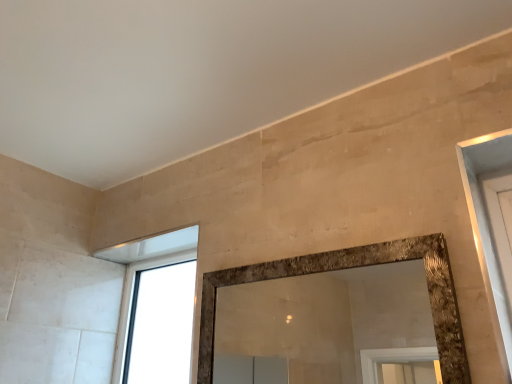
Question: Is the position of transparent glass window at upper left more distant than that of beige stone wall at upper center?

Choices:
 (A) no
 (B) yes

Answer: (B)

Question: Is transparent glass window at upper left not close to beige stone wall at upper center?

Choices:
 (A) yes
 (B) no

Answer: (B)

Question: Is transparent glass window at upper left located outside beige stone wall at upper center?

Choices:
 (A) yes
 (B) no

Answer: (A)

Question: Can you confirm if transparent glass window at upper left is smaller than beige stone wall at upper center?

Choices:
 (A) yes
 (B) no

Answer: (A)

Question: Is transparent glass window at upper left thinner than beige stone wall at upper center?

Choices:
 (A) no
 (B) yes

Answer: (B)

Question: Is transparent glass window at upper left placed right next to beige stone wall at upper center?

Choices:
 (A) no
 (B) yes

Answer: (A)

Question: Is beige stone wall at upper center wider than transparent glass window at upper left?

Choices:
 (A) no
 (B) yes

Answer: (B)

Question: Can you confirm if beige stone wall at upper center is positioned to the left of transparent glass window at upper left?

Choices:
 (A) yes
 (B) no

Answer: (B)

Question: Considering the relative sizes of beige stone wall at upper center and transparent glass window at upper left in the image provided, is beige stone wall at upper center taller than transparent glass window at upper left?

Choices:
 (A) no
 (B) yes

Answer: (A)

Question: Is beige stone wall at upper center to the right of transparent glass window at upper left from the viewer's perspective?

Choices:
 (A) no
 (B) yes

Answer: (B)

Question: Is beige stone wall at upper center with transparent glass window at upper left?

Choices:
 (A) yes
 (B) no

Answer: (B)

Question: From the image's perspective, does beige stone wall at upper center appear higher than transparent glass window at upper left?

Choices:
 (A) no
 (B) yes

Answer: (B)

Question: Is point (160, 375) closer or farther from the camera than point (83, 48)?

Choices:
 (A) closer
 (B) farther

Answer: (B)